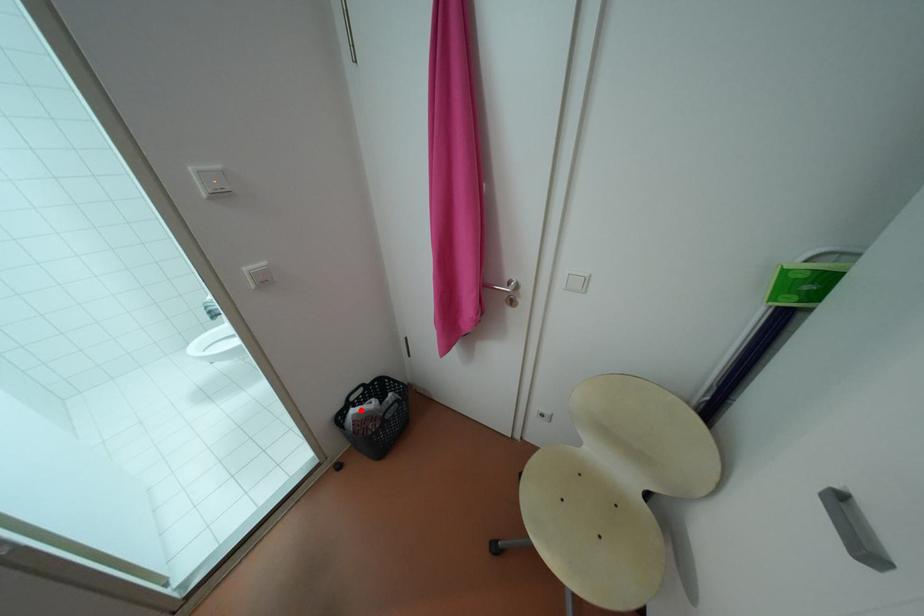
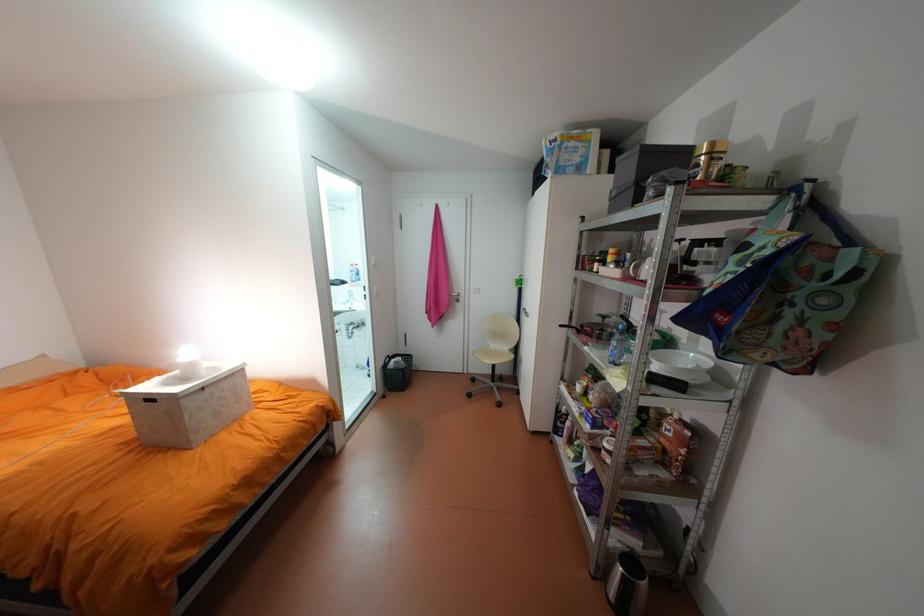
Where in the second image is the point corresponding to the highlighted location from the first image?

(402, 360)